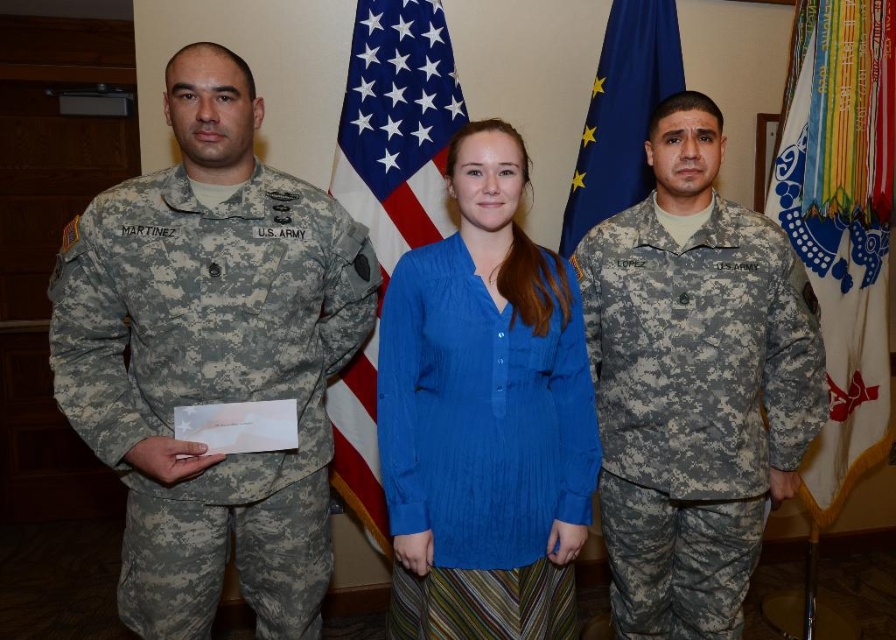
You are a photographer setting up for a group photo. You need to ensure that the camouflage fabric uniform at right and the blue cotton blouse at center are both visible in the frame. Based on their widths, which one might require more space in the photo to avoid being cut off?

The camouflage fabric uniform at right might be wider than the blue cotton blouse at center, so it might require more space in the photo to avoid being cut off.

You are an interior designer assessing the layout of this formal indoor scene. You need to determine if the camouflage fabric uniform at right can be moved to the position currently occupied by the american flag at center without overlapping. Based on their sizes, is this feasible?

The camouflage fabric uniform at right is bigger than the american flag at center. Moving it to the flag position would require more space, so it may not fit without overlapping.

From the picture: You are standing in the room and want to walk to both the point at coordinates (162, 568) and the point at coordinates (601, 54). Which point will you reach first if you move towards them at the same time?

You will reach point (162, 568) first because it is closer to you than point (601, 54).